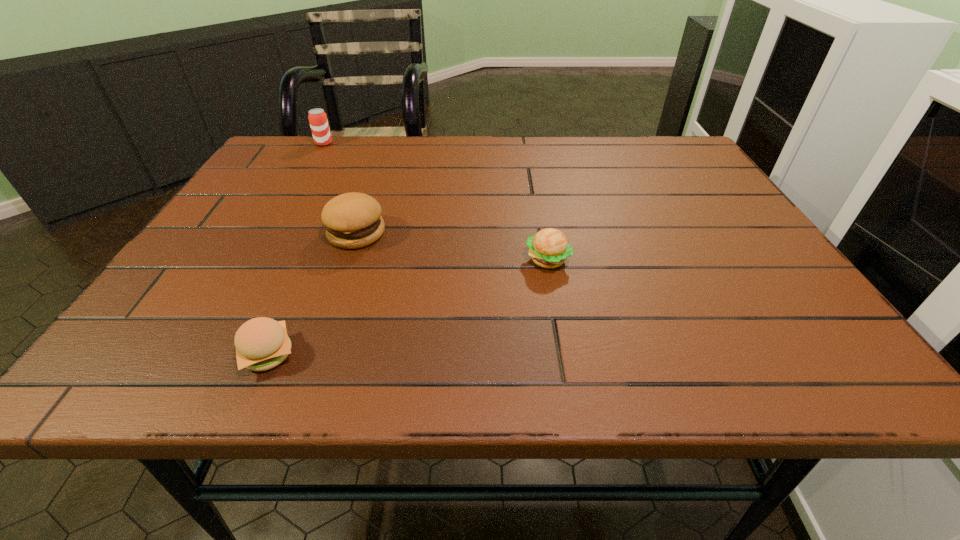
This screenshot has width=960, height=540. Find the location of `the second closest object relative to the leftmost object`. the second closest object relative to the leftmost object is located at coordinates (548, 248).

Identify which hamburger is the closest to the rightmost object. Please provide its 2D coordinates. Your answer should be formatted as a tuple, i.e. [(x, y)], where the tuple contains the x and y coordinates of a point satisfying the conditions above.

[(353, 220)]

Find the location of `hamburger that is the closest to the rightmost object`. hamburger that is the closest to the rightmost object is located at coordinates (353, 220).

Identify the location of free spot that satisfies the following two spatial constraints: 1. on the front side of the leftmost object; 2. on the left side of the rightmost hamburger. The height and width of the screenshot is (540, 960). [255, 260].